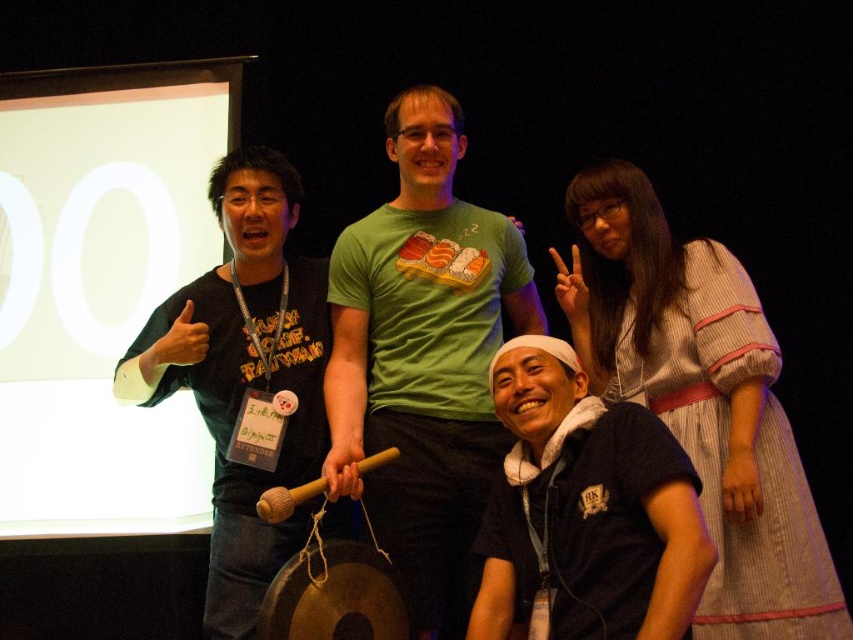
Between green t-shirt with sushi print at center and black matte shirt at left, which one has more height?

With more height is green t-shirt with sushi print at center.

Can you confirm if green t-shirt with sushi print at center is positioned below black matte shirt at left?

Correct, green t-shirt with sushi print at center is located below black matte shirt at left.

Locate an element on the screen. The image size is (853, 640). green t-shirt with sushi print at center is located at coordinates (422, 358).

Which is below, dark blue fabric at lower right or black matte shirt at left?

dark blue fabric at lower right is lower down.

Is point (584, 541) positioned behind point (236, 252)?

No, it is not.

Identify the location of dark blue fabric at lower right. (585, 512).

What are the coordinates of `dark blue fabric at lower right` in the screenshot? It's located at (585, 512).

Who is more distant from viewer, [450,204] or [608,547]?

Positioned behind is point [450,204].

Between green t-shirt with sushi print at center and dark blue fabric at lower right, which one appears on the right side from the viewer's perspective?

dark blue fabric at lower right

Who is more distant from viewer, [451,118] or [573,614]?

The point [451,118] is more distant.

Where is `green t-shirt with sushi print at center`? The height and width of the screenshot is (640, 853). green t-shirt with sushi print at center is located at coordinates (422, 358).